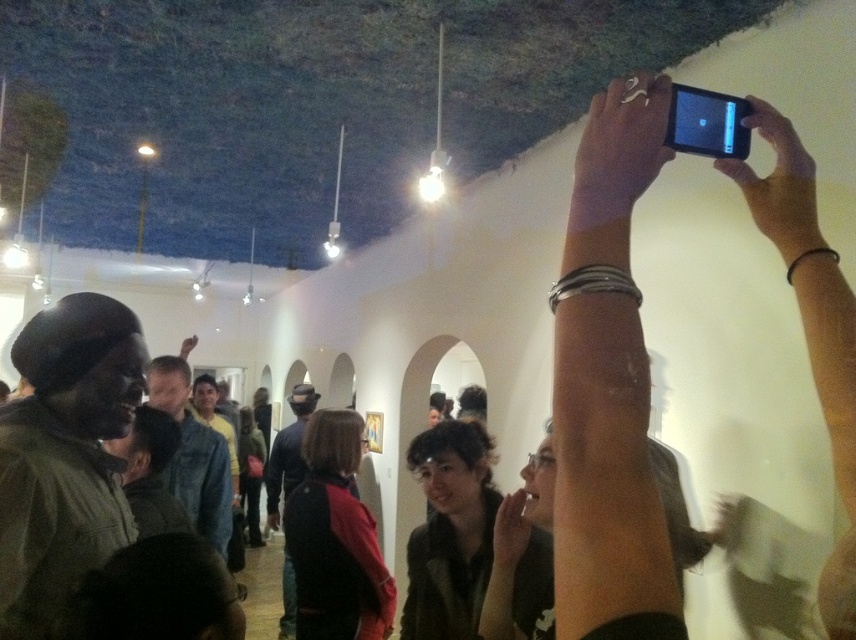
You are a photographer trying to capture the cave ceiling in the art gallery. You notice the smooth skin hand at upper right and the black matte phone at upper right. Which object is shorter in height?

The smooth skin hand at upper right is not as tall as the black matte phone at upper right, so the smooth skin hand at upper right is shorter in height.

You are standing in the art gallery and want to take a photo of the cave ceiling. There is a person holding a smartphone at point (619, 150). Can you estimate if the person is in a good position to capture the entire ceiling?

The smooth skin hand at upper right is represented by point (619, 150), which indicates the person is positioned at the upper right area. Since the cave ceiling spans the entire ceiling area, the person might need to move closer to the center to capture the entire ceiling in their photo.